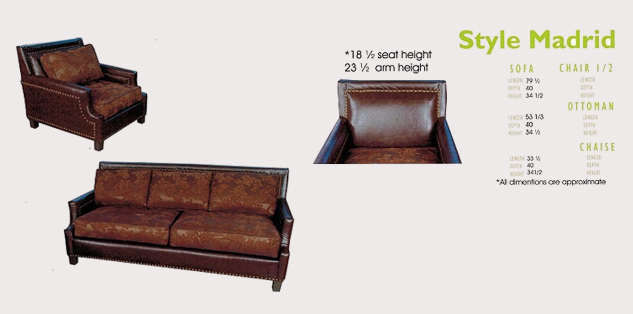
At what (x,y) coordinates should I click in order to perform the action: click on couch cushion seat. Please return your answer as a coordinate pair (x, y). The width and height of the screenshot is (633, 314). Looking at the image, I should click on (223, 222), (130, 222).